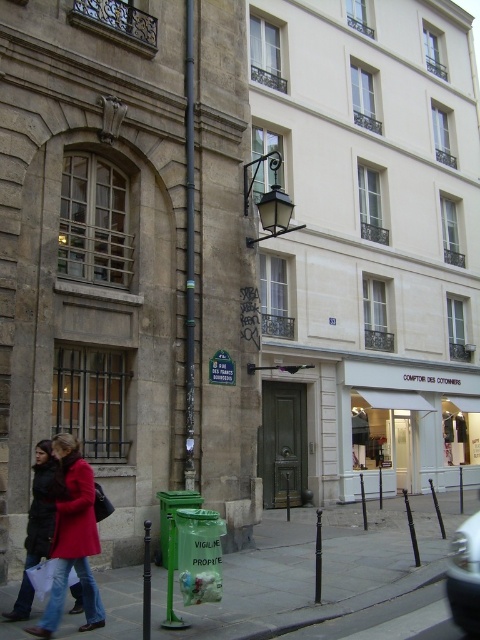
You are standing at point (192, 124) and want to walk to the historic building on the left side. Is the point (347, 557) between you and the building?

Yes, point (347, 557) is between you and the historic building on the left side because it is in front of point (192, 124), which is your current position.

Consider the image. You are standing at the corner of the street and want to walk to the smooth concrete pavement at lower center. What are the coordinates you should aim for?

The coordinates for the smooth concrete pavement at lower center are 0.894 in the x direction and 0.648 in the y direction.